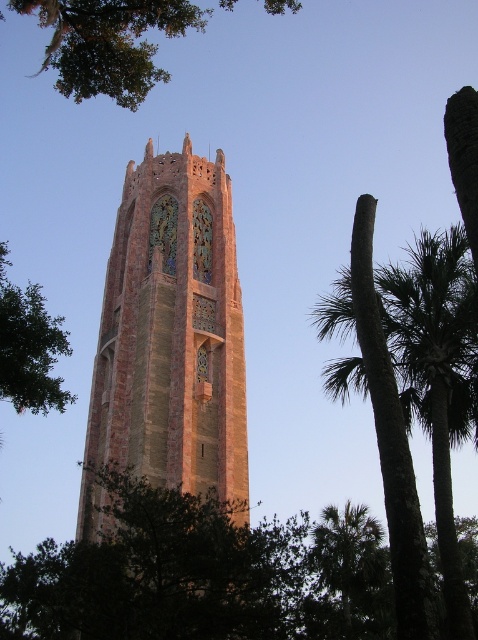
Question: Does green leafy palm tree at right appear over green leafy palm tree at lower right?

Choices:
 (A) yes
 (B) no

Answer: (A)

Question: Which point is farther to the camera?

Choices:
 (A) pyautogui.click(x=280, y=1)
 (B) pyautogui.click(x=421, y=548)
 (C) pyautogui.click(x=357, y=593)

Answer: (C)

Question: Can you confirm if green leafy palm tree at right is thinner than green leafy palm tree at lower right?

Choices:
 (A) yes
 (B) no

Answer: (A)

Question: Estimate the real-world distances between objects in this image. Which object is farther from the brick tower at center?

Choices:
 (A) green leafy palm tree at lower right
 (B) green leafy palm tree at right
 (C) green leafy tree at upper left

Answer: (A)

Question: Is green leafy palm tree at right thinner than green leafy palm tree at lower right?

Choices:
 (A) yes
 (B) no

Answer: (A)

Question: Which point appears farthest from the camera in this image?

Choices:
 (A) (412, 628)
 (B) (341, 536)
 (C) (131, 401)
 (D) (141, 20)

Answer: (B)